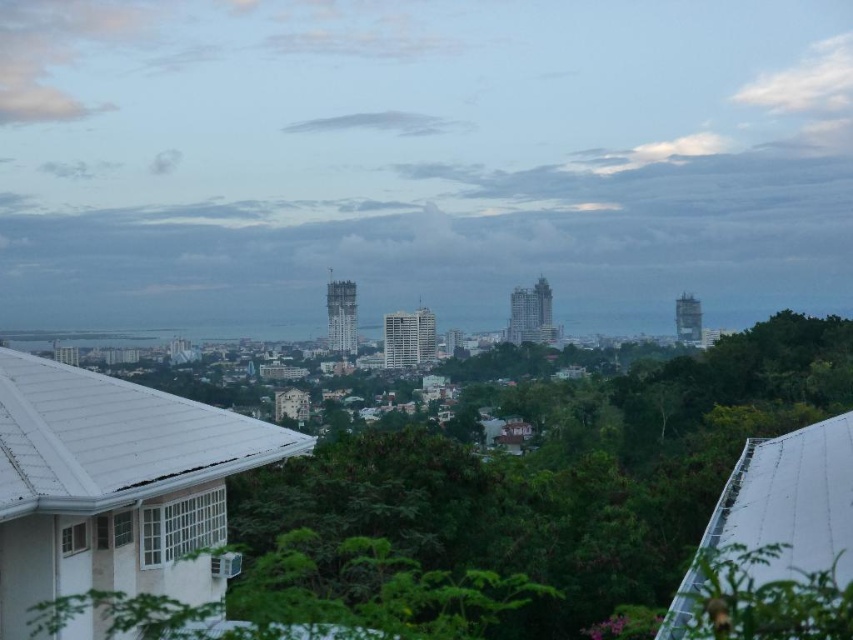
You are an urban planner assessing a cityscape. You need to determine which object occupies more visual space in the image. Based on the scene, which one is bigger between the smooth concrete skyline at center and the green leafy tree at lower center?

The smooth concrete skyline at center is larger in size than the green leafy tree at lower center, so it occupies more visual space in the image.

From the picture: You are standing at the viewpoint overlooking the city. You notice the smooth concrete skyline at center and the green leafy tree at lower center. Which object would appear larger in your field of view?

The smooth concrete skyline at center would appear larger in your field of view because it is wider than the green leafy tree at lower center.